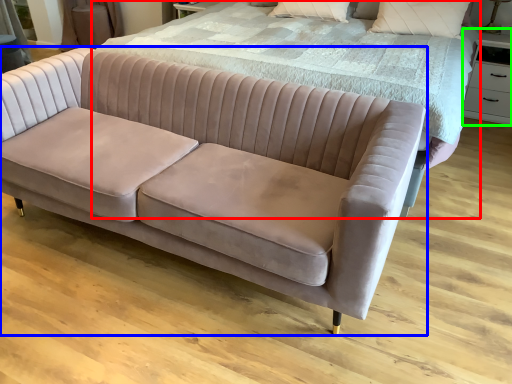
Question: Considering the real-world distances, which object is farthest from bed (highlighted by a red box)? studio couch (highlighted by a blue box) or side table (highlighted by a green box)?

Choices:
 (A) studio couch
 (B) side table

Answer: (B)